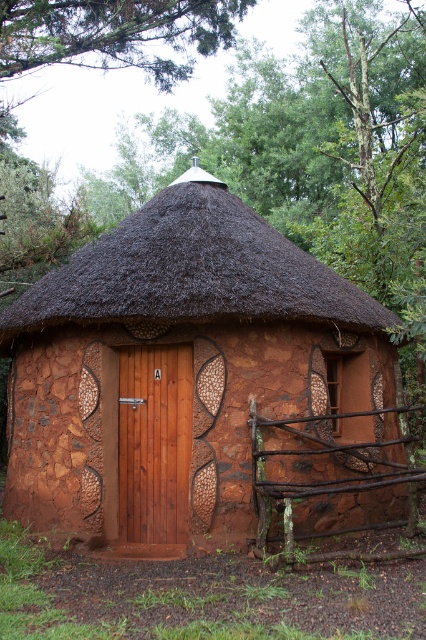
Question: Which point is closer to the camera?

Choices:
 (A) (389, 525)
 (B) (43, 486)

Answer: (A)

Question: Which point appears closest to the camera in this image?

Choices:
 (A) (216, 484)
 (B) (210, 176)

Answer: (A)

Question: Does terracotta stone hut at center appear on the right side of brown thatch at center?

Choices:
 (A) yes
 (B) no

Answer: (A)

Question: Estimate the real-world distances between objects in this image. Which object is closer to the wooden door at center?

Choices:
 (A) terracotta stone hut at center
 (B) brown thatch at center

Answer: (A)

Question: Does brown thatch at center appear on the right side of wooden door at center?

Choices:
 (A) no
 (B) yes

Answer: (B)

Question: In this image, where is brown thatch at center located relative to wooden door at center?

Choices:
 (A) above
 (B) below

Answer: (A)